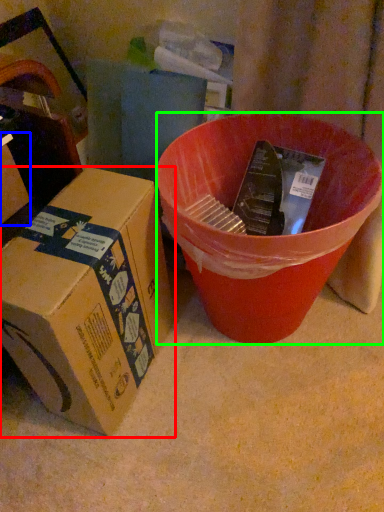
Question: Estimate the real-world distances between objects in this image. Which object is closer to box (highlighted by a red box), box (highlighted by a blue box) or bucket (highlighted by a green box)?

Choices:
 (A) box
 (B) bucket

Answer: (B)